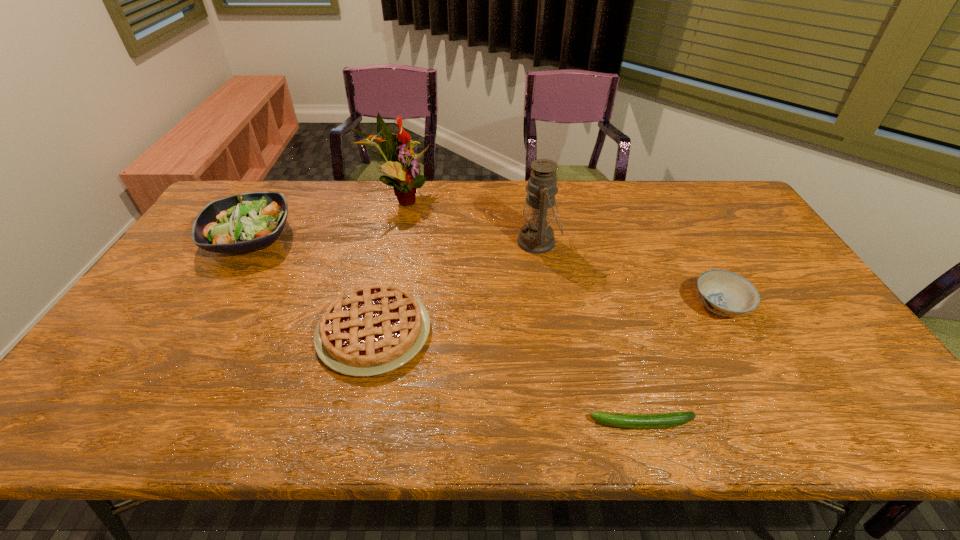
Locate an element on the screen. The width and height of the screenshot is (960, 540). free space between the shortest object and the bouquet is located at coordinates (520, 311).

Find the location of a particular element. This screenshot has width=960, height=540. free point between the salad plate and the bouquet is located at coordinates (324, 218).

You are a GUI agent. You are given a task and a screenshot of the screen. Output one action in this format:
    pyautogui.click(x=<x>, y=<y>)
    Task: Click on the free spot between the pie and the leftmost object
    The height and width of the screenshot is (540, 960).
    Given the screenshot: What is the action you would take?
    pyautogui.click(x=312, y=285)

The width and height of the screenshot is (960, 540). I want to click on blank region between the pie and the oil lamp, so click(456, 287).

Where is `free spot between the oil lamp and the bouquet`? free spot between the oil lamp and the bouquet is located at coordinates (468, 220).

Point out which object is positioned as the fifth nearest to the salad plate. Please provide its 2D coordinates. Your answer should be formatted as a tuple, i.e. [(x, y)], where the tuple contains the x and y coordinates of a point satisfying the conditions above.

[(724, 293)]

Where is `object that is the fifth nearest to the zucchini`? Image resolution: width=960 pixels, height=540 pixels. object that is the fifth nearest to the zucchini is located at coordinates (243, 222).

Identify the location of free space in the image that satisfies the following two spatial constraints: 1. on the front-facing side of the bouquet; 2. on the back side of the pie. Image resolution: width=960 pixels, height=540 pixels. (366, 332).

Where is `free space that satisfies the following two spatial constraints: 1. on the front side of the oil lamp; 2. on the left side of the bowl`? The image size is (960, 540). free space that satisfies the following two spatial constraints: 1. on the front side of the oil lamp; 2. on the left side of the bowl is located at coordinates (548, 306).

The width and height of the screenshot is (960, 540). Identify the location of free space that satisfies the following two spatial constraints: 1. on the front-facing side of the bouquet; 2. on the right side of the rightmost object. (372, 306).